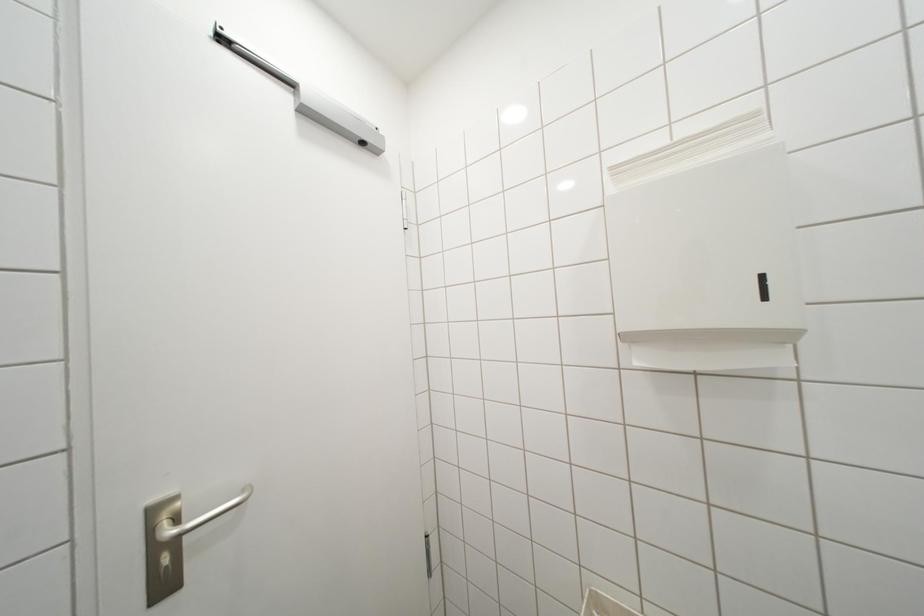
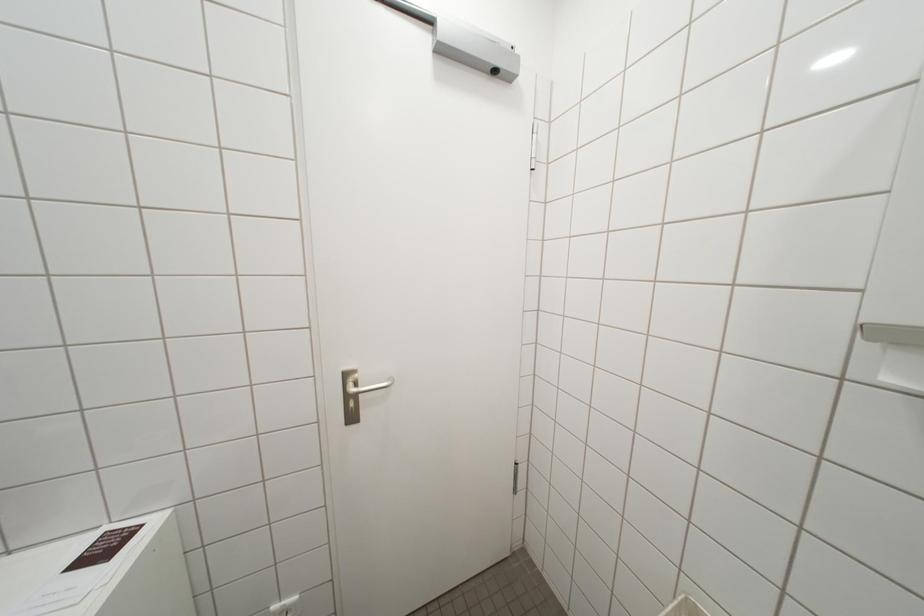
Question: Based on the continuous images, in which direction is the camera rotating? Reply with the corresponding letter.

Choices:
 (A) Left
 (B) Right
 (C) Up
 (D) Down

Answer: (A)